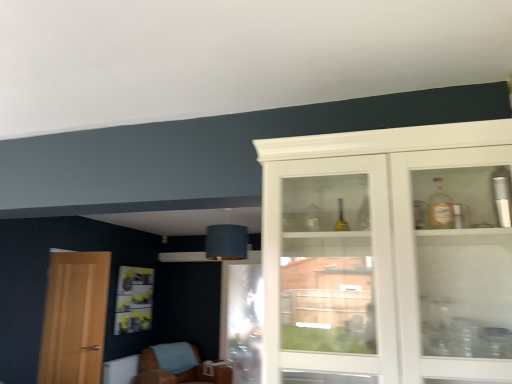
Question: From a real-world perspective, does brown leather chair at lower left sit lower than transparent glass screen door at lower center?

Choices:
 (A) no
 (B) yes

Answer: (B)

Question: Is brown leather chair at lower left at the left side of transparent glass screen door at lower center?

Choices:
 (A) yes
 (B) no

Answer: (A)

Question: From the image's perspective, is brown leather chair at lower left under transparent glass screen door at lower center?

Choices:
 (A) no
 (B) yes

Answer: (B)

Question: Does brown leather chair at lower left have a lesser width compared to transparent glass screen door at lower center?

Choices:
 (A) no
 (B) yes

Answer: (A)

Question: Does brown leather chair at lower left have a greater width compared to transparent glass screen door at lower center?

Choices:
 (A) no
 (B) yes

Answer: (B)

Question: From a real-world perspective, is light brown wooden door at left above or below brown leather chair at lower left?

Choices:
 (A) above
 (B) below

Answer: (A)

Question: Considering the positions of point (69, 288) and point (168, 370), is point (69, 288) closer or farther from the camera than point (168, 370)?

Choices:
 (A) closer
 (B) farther

Answer: (A)

Question: From the image's perspective, relative to brown leather chair at lower left, is light brown wooden door at left above or below?

Choices:
 (A) above
 (B) below

Answer: (A)

Question: Would you say light brown wooden door at left is inside or outside brown leather chair at lower left?

Choices:
 (A) inside
 (B) outside

Answer: (B)

Question: Looking at the image, does white glass cabinet at right seem bigger or smaller compared to transparent glass screen door at lower center?

Choices:
 (A) big
 (B) small

Answer: (A)

Question: Does point (330, 201) appear closer or farther from the camera than point (242, 350)?

Choices:
 (A) farther
 (B) closer

Answer: (B)

Question: From a real-world perspective, is white glass cabinet at right physically located above or below transparent glass screen door at lower center?

Choices:
 (A) above
 (B) below

Answer: (A)

Question: Is white glass cabinet at right inside the boundaries of transparent glass screen door at lower center, or outside?

Choices:
 (A) inside
 (B) outside

Answer: (B)

Question: From a real-world perspective, relative to brown leather chair at lower left, is white glass cabinet at right vertically above or below?

Choices:
 (A) below
 (B) above

Answer: (B)

Question: Is white glass cabinet at right taller or shorter than brown leather chair at lower left?

Choices:
 (A) short
 (B) tall

Answer: (B)